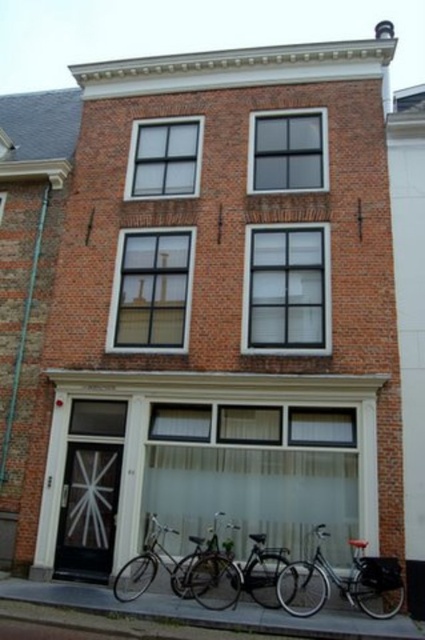
Question: Is matte glass door at lower left further to the viewer compared to transparent glass door at lower left?

Choices:
 (A) no
 (B) yes

Answer: (B)

Question: Which object appears closest to the camera in this image?

Choices:
 (A) shiny silver bicycle at lower center
 (B) matte glass door at lower left
 (C) shiny black bicycle at lower center

Answer: (C)

Question: Which object is farther from the camera taking this photo?

Choices:
 (A) shiny silver bicycle at lower right
 (B) shiny silver bicycle at lower center
 (C) transparent glass door at lower left
 (D) matte glass door at lower left

Answer: (D)

Question: Which of the following is the closest to the observer?

Choices:
 (A) shiny black bicycle at lower center
 (B) matte glass door at lower left
 (C) transparent glass door at lower left

Answer: (A)

Question: Is the position of transparent glass door at lower left more distant than that of shiny black bicycle at lower center?

Choices:
 (A) yes
 (B) no

Answer: (A)

Question: Does matte glass door at lower left have a larger size compared to shiny black bicycle at lower center?

Choices:
 (A) yes
 (B) no

Answer: (B)